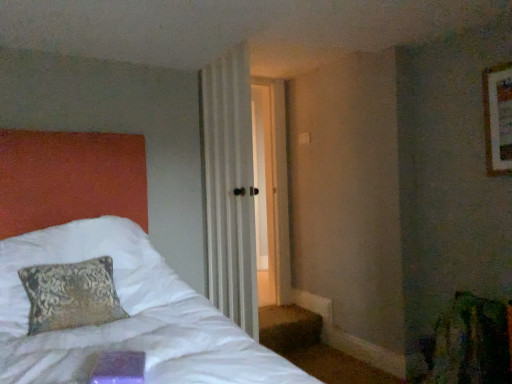
This screenshot has height=384, width=512. What do you see at coordinates (229, 186) in the screenshot?
I see `white striped curtain at center` at bounding box center [229, 186].

The image size is (512, 384). What are the coordinates of `white striped curtain at center` in the screenshot? It's located at (229, 186).

Measure the distance between wooden frame at upper right and camera.

The depth of wooden frame at upper right is 2.21 meters.

Where is `wooden frame at upper right`? This screenshot has height=384, width=512. wooden frame at upper right is located at coordinates (498, 118).

What do you see at coordinates (498, 118) in the screenshot?
I see `wooden frame at upper right` at bounding box center [498, 118].

Where is `white striped curtain at center`? white striped curtain at center is located at coordinates (229, 186).

Visually, is wooden frame at upper right positioned to the left or to the right of white striped curtain at center?

From the image, it's evident that wooden frame at upper right is to the right of white striped curtain at center.

Who is more distant, wooden frame at upper right or white striped curtain at center?

Positioned behind is white striped curtain at center.

Which is closer to the camera, [490,162] or [255,275]?

Point [490,162] is closer to the camera than point [255,275].

From the image's perspective, which is above, wooden frame at upper right or white striped curtain at center?

wooden frame at upper right.

From a real-world perspective, is wooden frame at upper right above or below white striped curtain at center?

In terms of real-world spatial position, wooden frame at upper right is above white striped curtain at center.

Does wooden frame at upper right have a greater width compared to white striped curtain at center?

Incorrect, the width of wooden frame at upper right does not surpass that of white striped curtain at center.

From their relative heights in the image, would you say wooden frame at upper right is taller or shorter than white striped curtain at center?

Considering their sizes, wooden frame at upper right has less height than white striped curtain at center.

Between wooden frame at upper right and white striped curtain at center, which one has smaller size?

wooden frame at upper right.

Is wooden frame at upper right positioned beyond the bounds of white striped curtain at center?

That's correct, wooden frame at upper right is outside of white striped curtain at center.

Is wooden frame at upper right in contact with white striped curtain at center?

No, wooden frame at upper right is not beside white striped curtain at center.

Is wooden frame at upper right aimed at white striped curtain at center?

No.

What's the angular difference between wooden frame at upper right and white striped curtain at center's facing directions?

There is a 5.68-degree angle between the facing directions of wooden frame at upper right and white striped curtain at center.

Measure the distance between wooden frame at upper right and white striped curtain at center.

A distance of 1.52 meters exists between wooden frame at upper right and white striped curtain at center.

What are the coordinates of `picture frame above the white striped curtain at center (from the image's perspective)` in the screenshot? It's located at (498, 118).

Does white striped curtain at center appear on the left side of wooden frame at upper right?

Correct, you'll find white striped curtain at center to the left of wooden frame at upper right.

Is white striped curtain at center positioned in front of wooden frame at upper right?

No, white striped curtain at center is further to the viewer.

Which point is more distant from viewer, (203, 91) or (487, 100)?

The point (203, 91) is behind.

From the image's perspective, relative to wooden frame at upper right, is white striped curtain at center above or below?

white striped curtain at center is below wooden frame at upper right.

From a real-world perspective, who is located lower, white striped curtain at center or wooden frame at upper right?

From a 3D spatial view, white striped curtain at center is below.

Based on the photo, can you confirm if white striped curtain at center is thinner than wooden frame at upper right?

No, white striped curtain at center is not thinner than wooden frame at upper right.

In the scene shown: Can you confirm if white striped curtain at center is taller than wooden frame at upper right?

Yes.

Considering the relative sizes of white striped curtain at center and wooden frame at upper right in the image provided, is white striped curtain at center smaller than wooden frame at upper right?

Actually, white striped curtain at center might be larger than wooden frame at upper right.

Is white striped curtain at center inside or outside of wooden frame at upper right?

white striped curtain at center cannot be found inside wooden frame at upper right.

Would you say white striped curtain at center is a long distance from wooden frame at upper right?

white striped curtain at center is positioned a significant distance from wooden frame at upper right.

Is white striped curtain at center positioned with its back to wooden frame at upper right?

No, white striped curtain at center is not facing away from wooden frame at upper right.

What's the angular difference between white striped curtain at center and wooden frame at upper right's facing directions?

They differ by 5.68 degrees in their facing directions.

How much distance is there between white striped curtain at center and wooden frame at upper right?

white striped curtain at center is 1.52 meters from wooden frame at upper right.

Where is `curtain below the wooden frame at upper right (from a real-world perspective)`? This screenshot has height=384, width=512. curtain below the wooden frame at upper right (from a real-world perspective) is located at coordinates (229, 186).

Locate an element on the screen. picture frame on the right of white striped curtain at center is located at coordinates (498, 118).

In order to click on picture frame that appears above the white striped curtain at center (from a real-world perspective) in this screenshot , I will do `click(498, 118)`.